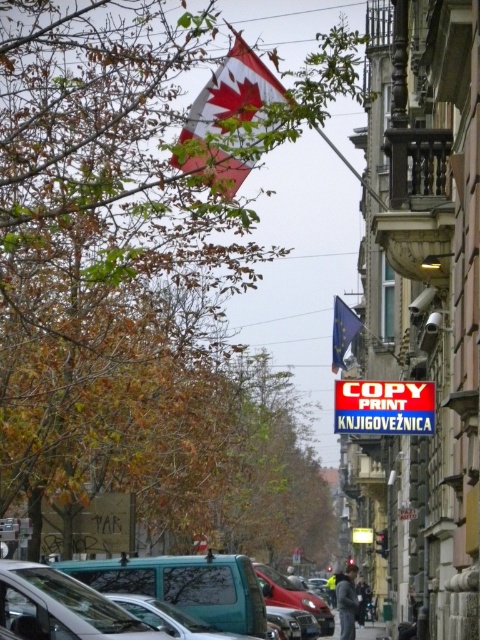
You are a delivery person trying to navigate through the street. You need to pass between the red and white fabric flag at upper center and the dark gray fabric jacket at center. Can you estimate if there is enough space for your delivery cart that is 1.2 meters wide?

The red and white fabric flag at upper center is wider than the dark gray fabric jacket at center. Since the flag is wider, the space between them might be sufficient for the delivery cart. However, without exact measurements of the distance between them, it is difficult to confirm. Please check the actual space before proceeding.

You are a pedestrian walking on the street and want to take a photo of the dark gray fabric jacket at center without the red and white fabric flag at upper center blocking the view. Is it possible to position yourself in such a way that the jacket is visible but the flag is not in the frame?

The red and white fabric flag at upper center is in front of the dark gray fabric jacket at center, so it is possible to position yourself in such a way that the jacket is visible but the flag is not in the frame by moving to a position where the flag is out of the line of sight.

You are standing at the intersection and want to walk towards the building with the security camera. There are two points marked on the ground, point (x=219, y=556) and point (x=372, y=637). Which point should you step on first to reach the building with the security camera?

You should step on point (x=219, y=556) first because it is in front of point (x=372, y=637), so stepping on it first will bring you closer to the building with the security camera.